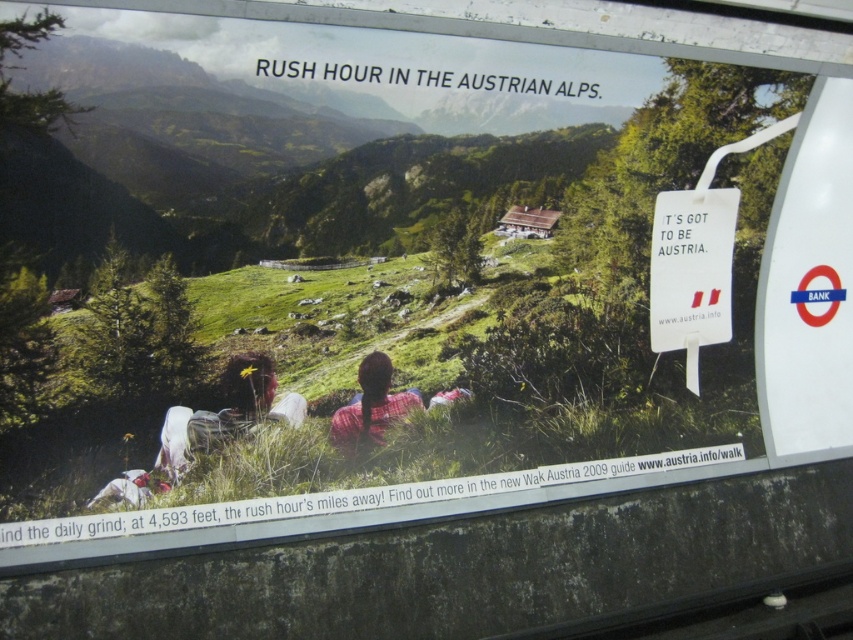
Question: Which object is farther from the camera taking this photo?

Choices:
 (A) plaid shirt at center
 (B) matte black backpack at center

Answer: (A)

Question: Is matte black backpack at center to the left of plaid shirt at center from the viewer's perspective?

Choices:
 (A) no
 (B) yes

Answer: (B)

Question: From the image, what is the correct spatial relationship of matte black backpack at center in relation to plaid shirt at center?

Choices:
 (A) below
 (B) above

Answer: (B)

Question: Can you confirm if matte black backpack at center is positioned to the left of plaid shirt at center?

Choices:
 (A) no
 (B) yes

Answer: (B)